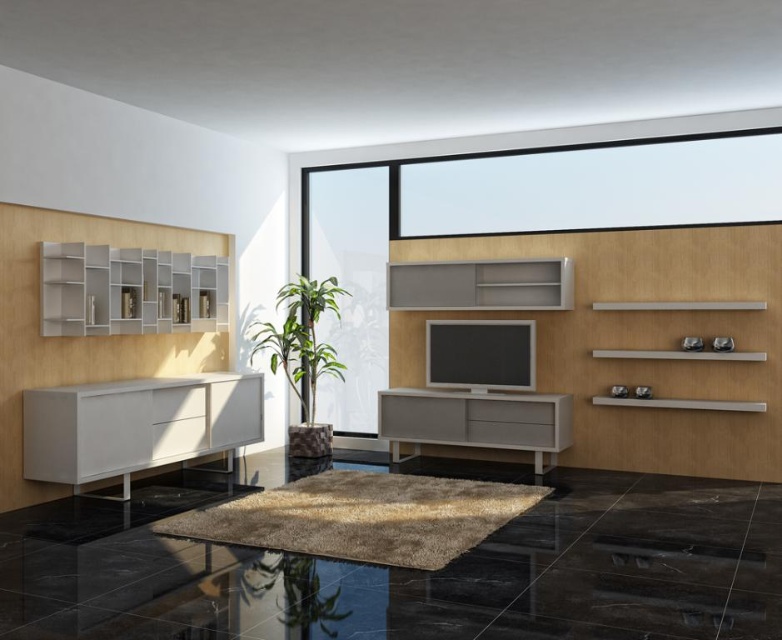
Does white matte shelves at left appear on the left side of matte gray cabinet at center?

Correct, you'll find white matte shelves at left to the left of matte gray cabinet at center.

Between white matte shelves at left and matte gray cabinet at center, which one appears on the right side from the viewer's perspective?

matte gray cabinet at center

Between point (138, 253) and point (393, 401), which one is positioned in front?

Point (138, 253) is in front.

Locate an element on the screen. The width and height of the screenshot is (782, 640). white matte shelves at left is located at coordinates (128, 291).

Is point (522, 298) positioned after point (321, 348)?

No, (522, 298) is in front of (321, 348).

Can you confirm if matte gray shelf at upper center is thinner than green leafy plant at center?

In fact, matte gray shelf at upper center might be wider than green leafy plant at center.

Does point (515, 259) come behind point (293, 344)?

No, it is in front of (293, 344).

Identify the location of matte gray shelf at upper center. This screenshot has height=640, width=782. (481, 284).

Can you confirm if white matte shelves at left is positioned to the right of green leafy plant at center?

Incorrect, white matte shelves at left is not on the right side of green leafy plant at center.

Between white matte shelves at left and green leafy plant at center, which one appears on the right side from the viewer's perspective?

green leafy plant at center

This screenshot has width=782, height=640. Describe the element at coordinates (128, 291) in the screenshot. I see `white matte shelves at left` at that location.

In order to click on white matte shelves at left in this screenshot , I will do `click(128, 291)`.